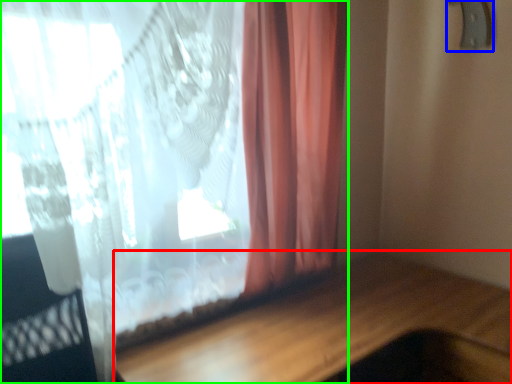
Question: Which object is the farthest from table (highlighted by a red box)? Choose among these: door handle (highlighted by a blue box) or curtain (highlighted by a green box).

Choices:
 (A) door handle
 (B) curtain

Answer: (A)